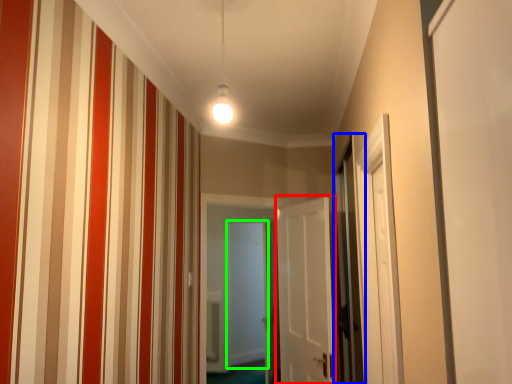
Question: Estimate the real-world distances between objects in this image. Which object is closer to door (highlighted by a red box), screen door (highlighted by a blue box) or screen door (highlighted by a green box)?

Choices:
 (A) screen door
 (B) screen door

Answer: (A)